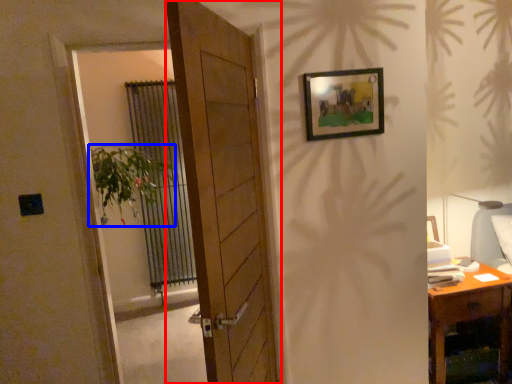
Question: Which of the following is the farthest to the observer, door (highlighted by a red box) or houseplant (highlighted by a blue box)?

Choices:
 (A) door
 (B) houseplant

Answer: (B)